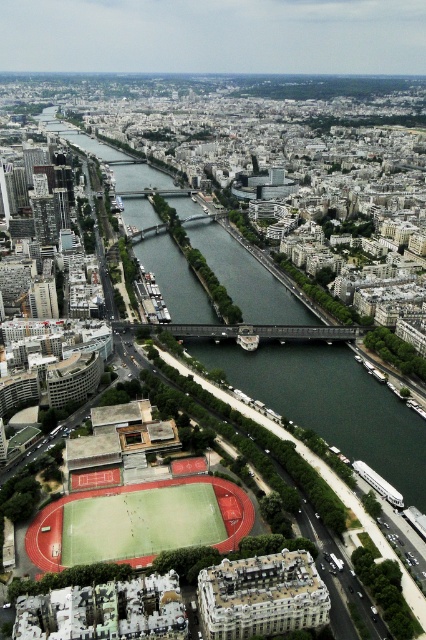
Question: Which point is closer to the camera?

Choices:
 (A) dark green water at center
 (B) green turf football field at lower center

Answer: (B)

Question: Is dark green water at center above green turf football field at lower center?

Choices:
 (A) no
 (B) yes

Answer: (B)

Question: Which point appears farthest from the camera in this image?

Choices:
 (A) (37, 520)
 (B) (393, 442)

Answer: (B)

Question: Can you confirm if dark green water at center is thinner than green turf football field at lower center?

Choices:
 (A) yes
 (B) no

Answer: (B)

Question: Among these points, which one is farthest from the camera?

Choices:
 (A) (357, 433)
 (B) (43, 524)

Answer: (A)

Question: Can you confirm if dark green water at center is positioned to the left of green turf football field at lower center?

Choices:
 (A) yes
 (B) no

Answer: (A)